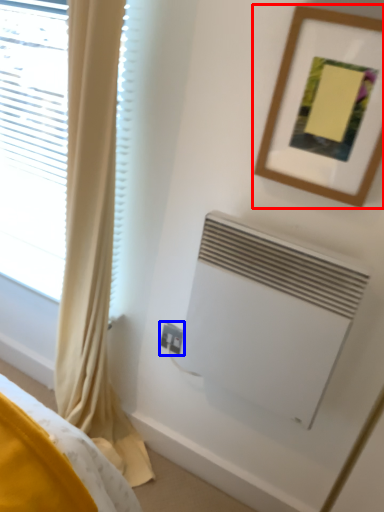
Question: Which object is further to the camera taking this photo, picture frame (highlighted by a red box) or electric outlet (highlighted by a blue box)?

Choices:
 (A) picture frame
 (B) electric outlet

Answer: (B)